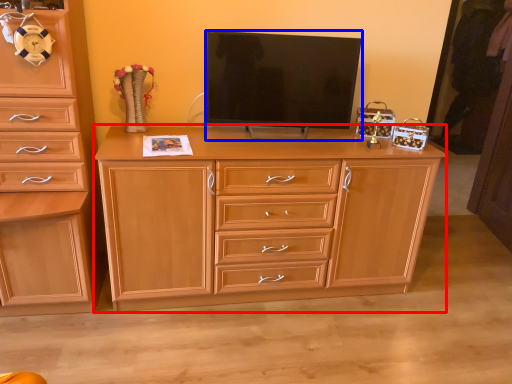
Question: Which object appears closest to the camera in this image, chest of drawers (highlighted by a red box) or television (highlighted by a blue box)?

Choices:
 (A) chest of drawers
 (B) television

Answer: (A)